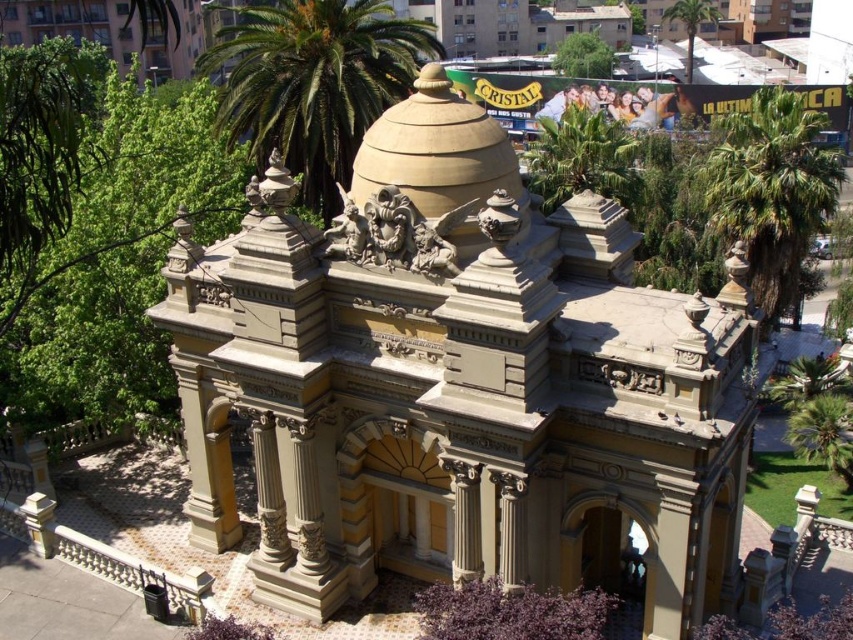
Is point (582, 65) positioned after point (691, 12)?

No, it is not.

Does green leafy tree at upper center appear on the left side of green leafy palm tree at upper center?

Correct, you'll find green leafy tree at upper center to the left of green leafy palm tree at upper center.

The image size is (853, 640). What do you see at coordinates (583, 56) in the screenshot?
I see `green leafy tree at upper center` at bounding box center [583, 56].

Locate an element on the screen. The image size is (853, 640). green leafy tree at upper center is located at coordinates (583, 56).

Is green leafy palm at center below green leafy palm tree at lower right?

No.

How distant is green leafy palm at center from green leafy palm tree at lower right?

27.14 meters

Measure the distance between point (x=318, y=58) and camera.

The distance of point (x=318, y=58) from camera is 43.72 meters.

Image resolution: width=853 pixels, height=640 pixels. Find the location of `green leafy palm at center`. green leafy palm at center is located at coordinates (312, 83).

Who is higher up, green leafy palm tree at right or green leafy palm tree at lower right?

green leafy palm tree at right

Which of these two, green leafy palm tree at right or green leafy palm tree at lower right, stands taller?

With more height is green leafy palm tree at right.

Is point (799, 221) positioned before point (846, 401)?

No, it is not.

The height and width of the screenshot is (640, 853). Identify the location of green leafy palm tree at right. (772, 188).